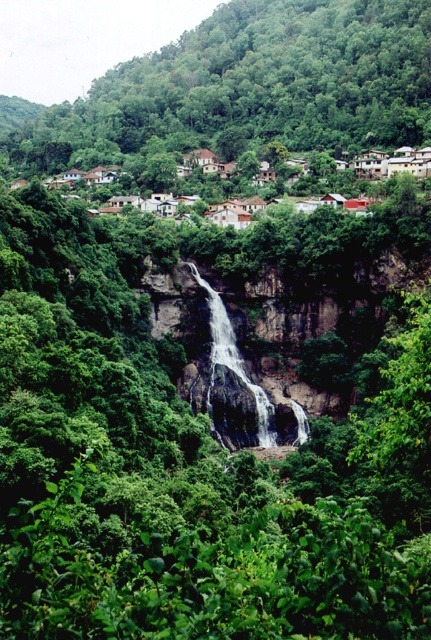
Question: Which is farther from the green leafy tree at upper center?

Choices:
 (A) brown wooden houses at upper center
 (B) white smooth waterfall at center

Answer: (B)

Question: Does green leafy tree at upper center appear under white smooth waterfall at center?

Choices:
 (A) yes
 (B) no

Answer: (B)

Question: Is brown wooden houses at upper center to the right of white smooth waterfall at center from the viewer's perspective?

Choices:
 (A) no
 (B) yes

Answer: (B)

Question: Which point is farther to the camera?

Choices:
 (A) brown wooden houses at upper center
 (B) white smooth waterfall at center
 (C) green leafy tree at upper center

Answer: (C)

Question: Does brown wooden houses at upper center appear on the right side of white smooth waterfall at center?

Choices:
 (A) no
 (B) yes

Answer: (B)

Question: Which point appears closest to the camera in this image?

Choices:
 (A) (224, 364)
 (B) (408, 106)

Answer: (A)